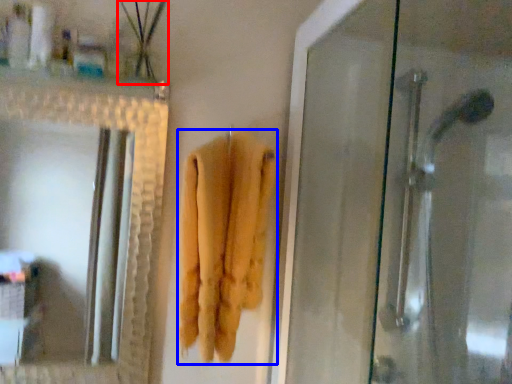
Question: Which object appears farthest to the camera in this image, plant (highlighted by a red box) or towel (highlighted by a blue box)?

Choices:
 (A) plant
 (B) towel

Answer: (A)